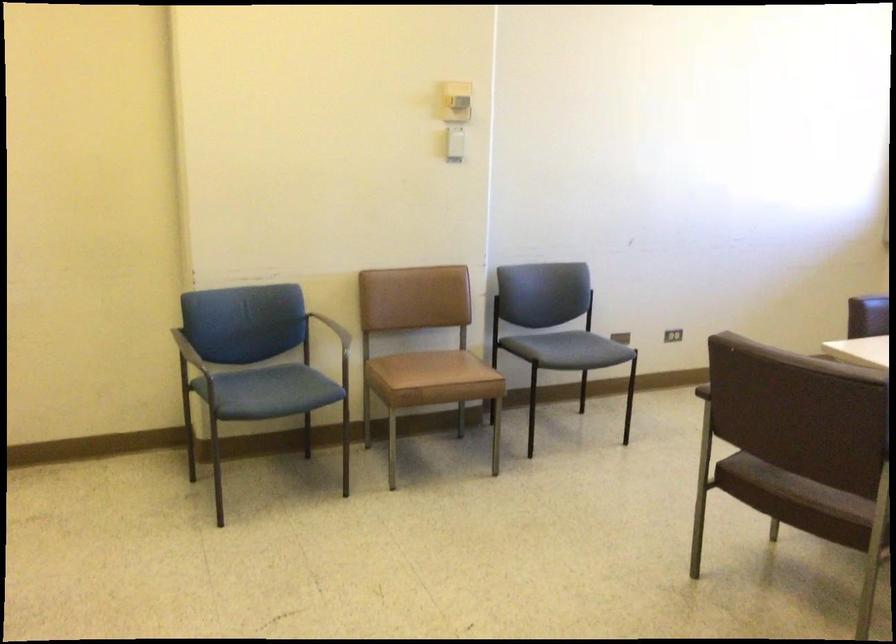
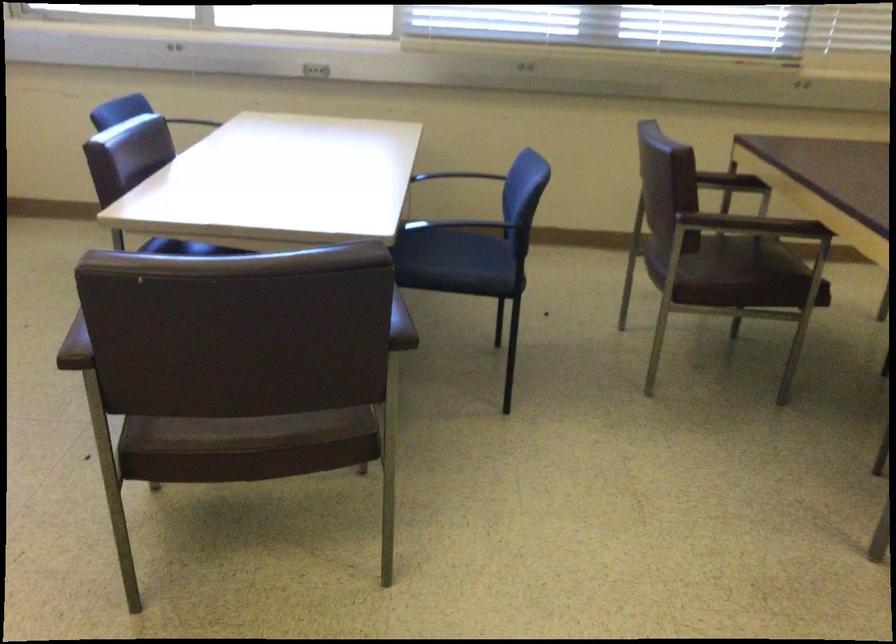
The point at (x=721, y=381) is marked in the first image. Where is the corresponding point in the second image?

(75, 346)